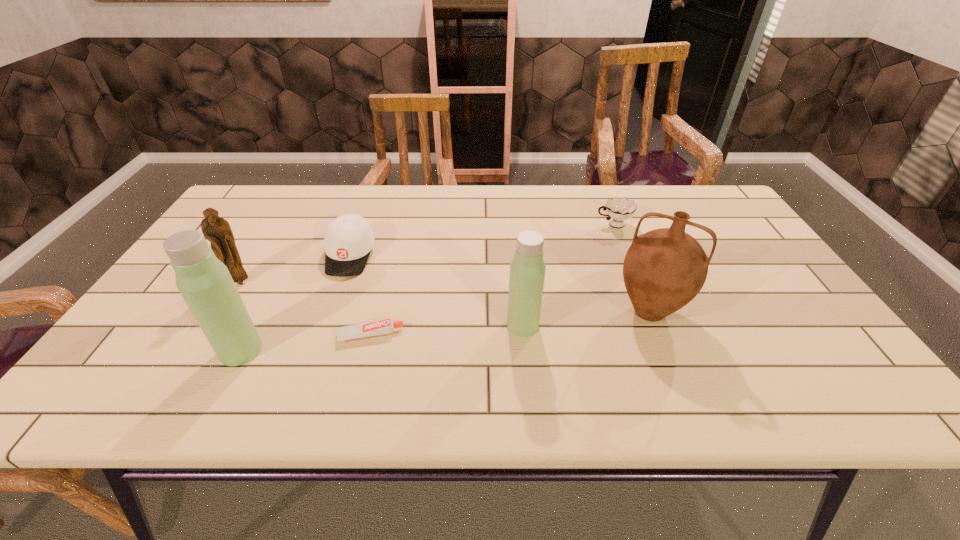
Locate an element on the screen. The image size is (960, 540). free space that satisfies the following two spatial constraints: 1. on the back side of the shorter thermos bottle; 2. on the side of the sixth tallest object with the handle is located at coordinates (513, 225).